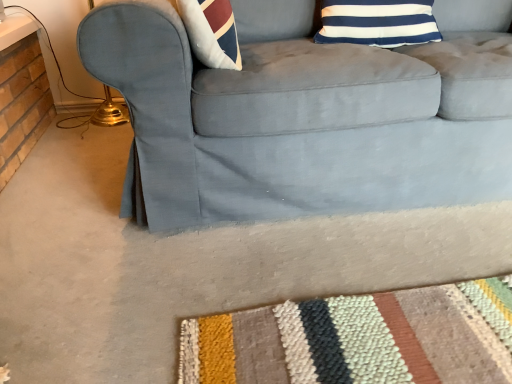
The image size is (512, 384). Describe the element at coordinates (378, 22) in the screenshot. I see `blue/white striped pillow at upper right` at that location.

The image size is (512, 384). In order to click on blue/white striped pillow at upper right in this screenshot , I will do `click(378, 22)`.

Measure the distance between blue/white striped pillow at upper right and camera.

The depth of blue/white striped pillow at upper right is 4.39 feet.

Based on the photo, measure the distance between point [372,39] and camera.

Point [372,39] and camera are 1.34 meters apart from each other.

In order to face blue/white striped pillow at upper right, should I rotate leftwards or rightwards?

A 16.243 degree turn to the right will do.

Find the location of a particular element. This screenshot has width=512, height=384. suede couch at center is located at coordinates (301, 117).

This screenshot has height=384, width=512. Describe the element at coordinates (301, 117) in the screenshot. I see `suede couch at center` at that location.

At what (x,y) coordinates should I click in order to perform the action: click on blue/white striped pillow at upper right. Please return your answer as a coordinate pair (x, y). Image resolution: width=512 pixels, height=384 pixels. Looking at the image, I should click on (378, 22).

Considering the relative positions of suede couch at center and blue/white striped pillow at upper right in the image provided, is suede couch at center to the left or to the right of blue/white striped pillow at upper right?

suede couch at center is to the right of blue/white striped pillow at upper right.

Which is in front, suede couch at center or blue/white striped pillow at upper right?

suede couch at center is more forward.

Which point is more distant from viewer, (347, 155) or (330, 7)?

The point (330, 7) is farther from the camera.

From the image's perspective, is suede couch at center under blue/white striped pillow at upper right?

Correct, suede couch at center appears lower than blue/white striped pillow at upper right in the image.

From a real-world perspective, between suede couch at center and blue/white striped pillow at upper right, who is vertically higher?

From a 3D spatial view, blue/white striped pillow at upper right is above.

Does suede couch at center have a lesser width compared to blue/white striped pillow at upper right?

No.

Can you confirm if suede couch at center is shorter than blue/white striped pillow at upper right?

No, suede couch at center is not shorter than blue/white striped pillow at upper right.

In the scene shown: Considering the relative sizes of suede couch at center and blue/white striped pillow at upper right in the image provided, is suede couch at center bigger than blue/white striped pillow at upper right?

Yes, suede couch at center is bigger than blue/white striped pillow at upper right.

Is suede couch at center spatially inside blue/white striped pillow at upper right, or outside of it?

suede couch at center is not enclosed by blue/white striped pillow at upper right.

Would you say suede couch at center is a long distance from blue/white striped pillow at upper right?

No, suede couch at center is not far away from blue/white striped pillow at upper right.

Is suede couch at center oriented away from blue/white striped pillow at upper right?

Yes, suede couch at center's orientation is away from blue/white striped pillow at upper right.

At what (x,y) coordinates should I click in order to perform the action: click on pillow located above the suede couch at center (from a real-world perspective). Please return your answer as a coordinate pair (x, y). Image resolution: width=512 pixels, height=384 pixels. Looking at the image, I should click on (378, 22).

Does blue/white striped pillow at upper right appear on the left side of suede couch at center?

Yes, blue/white striped pillow at upper right is to the left of suede couch at center.

Is the depth of blue/white striped pillow at upper right greater than that of suede couch at center?

Yes, it is.

Which is in front, point (429, 22) or point (388, 92)?

The point (388, 92) is in front.

From the image's perspective, which object appears higher, blue/white striped pillow at upper right or suede couch at center?

blue/white striped pillow at upper right appears higher in the image.

From a real-world perspective, is blue/white striped pillow at upper right physically located above or below suede couch at center?

blue/white striped pillow at upper right is above suede couch at center.

In terms of width, does blue/white striped pillow at upper right look wider or thinner when compared to suede couch at center?

In the image, blue/white striped pillow at upper right appears to be more narrow than suede couch at center.

Can you confirm if blue/white striped pillow at upper right is taller than suede couch at center?

No.

Is blue/white striped pillow at upper right smaller than suede couch at center?

Yes, blue/white striped pillow at upper right is smaller than suede couch at center.

Is blue/white striped pillow at upper right positioned beyond the bounds of suede couch at center?

No, blue/white striped pillow at upper right is inside or overlapping with suede couch at center.

Looking at this image, are blue/white striped pillow at upper right and suede couch at center located far from each other?

blue/white striped pillow at upper right is actually quite close to suede couch at center.

Could you tell me if blue/white striped pillow at upper right is facing suede couch at center?

Yes, blue/white striped pillow at upper right faces towards suede couch at center.

Can you tell me how much blue/white striped pillow at upper right and suede couch at center differ in facing direction?

There is a 0.0817-degree angle between the facing directions of blue/white striped pillow at upper right and suede couch at center.

Image resolution: width=512 pixels, height=384 pixels. I want to click on pillow located above the suede couch at center (from a real-world perspective), so click(378, 22).

What are the coordinates of `studio couch below the blue/white striped pillow at upper right (from the image's perspective)` in the screenshot? It's located at (301, 117).

At what (x,y) coordinates should I click in order to perform the action: click on pillow on the left of suede couch at center. Please return your answer as a coordinate pair (x, y). This screenshot has width=512, height=384. Looking at the image, I should click on (378, 22).